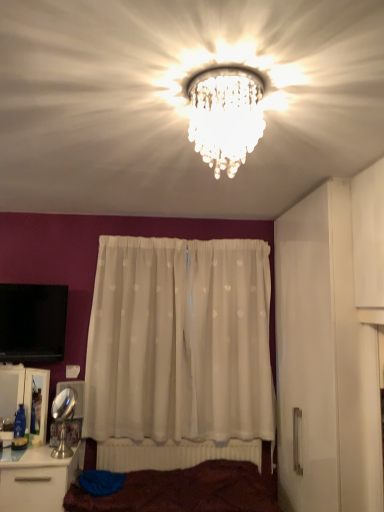
Find the location of a particular element. The width and height of the screenshot is (384, 512). empty space that is ontop of white glossy cabinet at lower left (from a real-world perspective) is located at coordinates (23, 361).